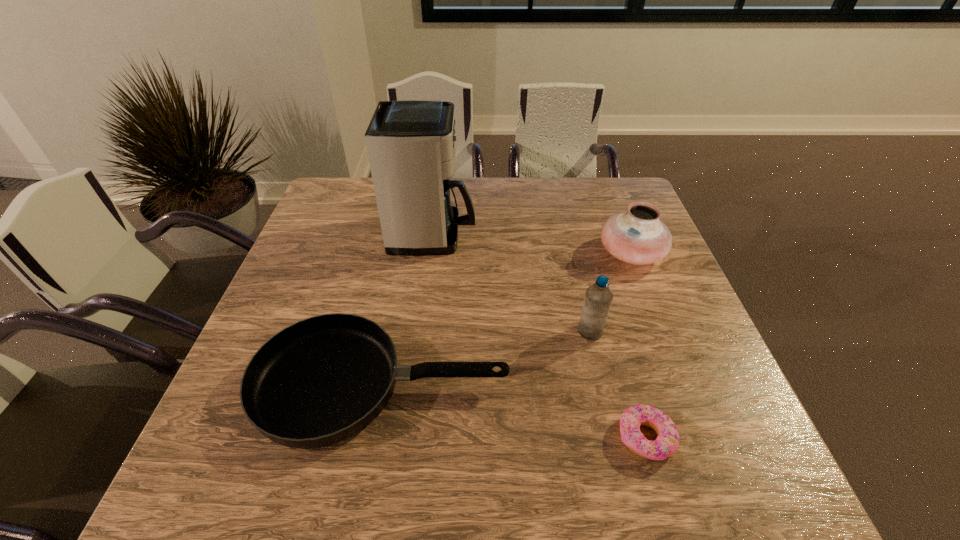
Identify the location of coffee maker. (411, 144).

Find the location of a particular element. This screenshot has height=540, width=960. water bottle is located at coordinates (598, 298).

Locate an element on the screen. the third shortest object is located at coordinates (637, 236).

What are the coordinates of `the second shortest object` in the screenshot? It's located at (321, 380).

Locate an element on the screen. This screenshot has width=960, height=540. the shortest object is located at coordinates (667, 442).

Locate an element on the screen. Image resolution: width=960 pixels, height=540 pixels. free point located 0.200m on the front panel of the coffee maker is located at coordinates pos(544,234).

Where is `free region located on the right of the water bottle`? free region located on the right of the water bottle is located at coordinates (699, 332).

Identify the location of free space located 0.120m on the left of the third shortest object. click(x=554, y=253).

I want to click on free location located 0.330m at the end of the handle of the fourth tallest object, so click(x=670, y=386).

Where is `free region located 0.170m on the back of the doughnut`? The image size is (960, 540). free region located 0.170m on the back of the doughnut is located at coordinates (618, 343).